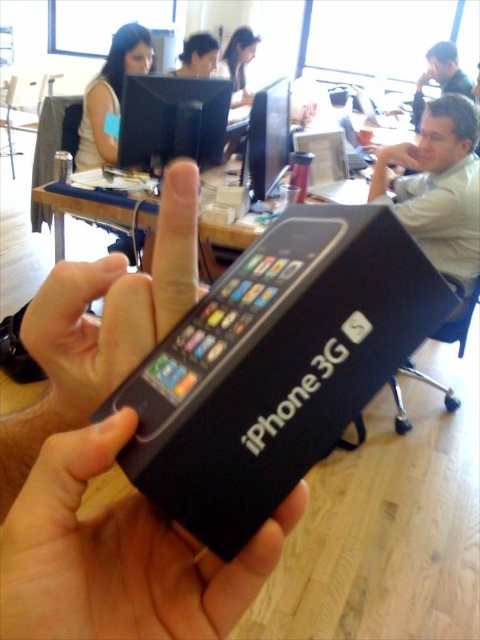
You are standing in an office workspace with large windows and bright lighting. You see a person holding an iPhone 3G box with their hands. Their thumb is pointing at the top left corner of the box. There is also a point marked at coordinates (276,365) in the scene. What object does this point indicate?

The point at coordinates (276,365) marks the black matte iPhone 3G at center.

You are organizing a tech exhibition and need to place the black matte iPhone 3G at center and the black plastic monitor at upper center on a display table. Given their sizes, which object should be placed first to ensure stability?

The black matte iPhone 3G at center should be placed first because it is smaller than the black plastic monitor at upper center, allowing it to be positioned securely on top of or beside the larger monitor without risking instability.

Looking at the scene described, where is the black matte iPhone 3G at center in relation to the black plastic monitor at upper center?

The black matte iPhone 3G at center is located to the right of the black plastic monitor at upper center.